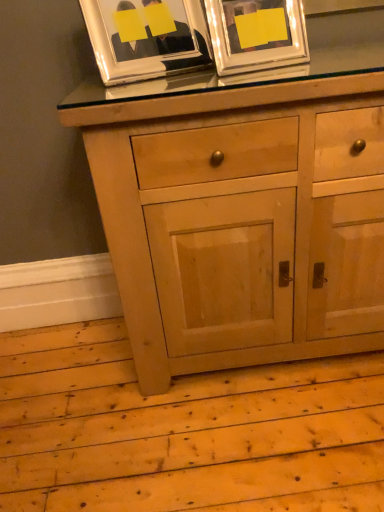
This screenshot has height=512, width=384. Identify the location of vacant space underneath silver metallic picture frame at upper left, the 2th picture frame when ordered from right to left (from a real-world perspective). (152, 81).